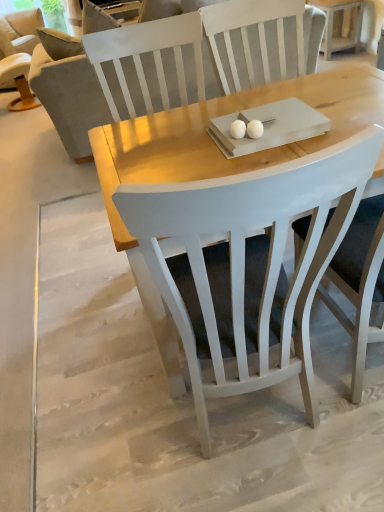
Question: From a real-world perspective, is gray fabric couch at left above or below beige fabric chair at upper left, which is counted as the second chair, starting from the right?

Choices:
 (A) above
 (B) below

Answer: (A)

Question: Is point (155, 105) positioned closer to the camera than point (34, 18)?

Choices:
 (A) farther
 (B) closer

Answer: (B)

Question: Estimate the real-world distances between objects in this image. Which object is farther from the white wood side table at upper right?

Choices:
 (A) gray fabric couch at left
 (B) beige fabric chair at upper left, the first chair viewed from the left
 (C) white wood chair at center, the 1th chair from the right

Answer: (C)

Question: Estimate the real-world distances between objects in this image. Which object is closer to the white wood chair at center, which is counted as the first chair, starting from the bottom?

Choices:
 (A) white wood side table at upper right
 (B) gray fabric couch at left
 (C) beige fabric chair at upper left, which is counted as the second chair, starting from the right

Answer: (B)